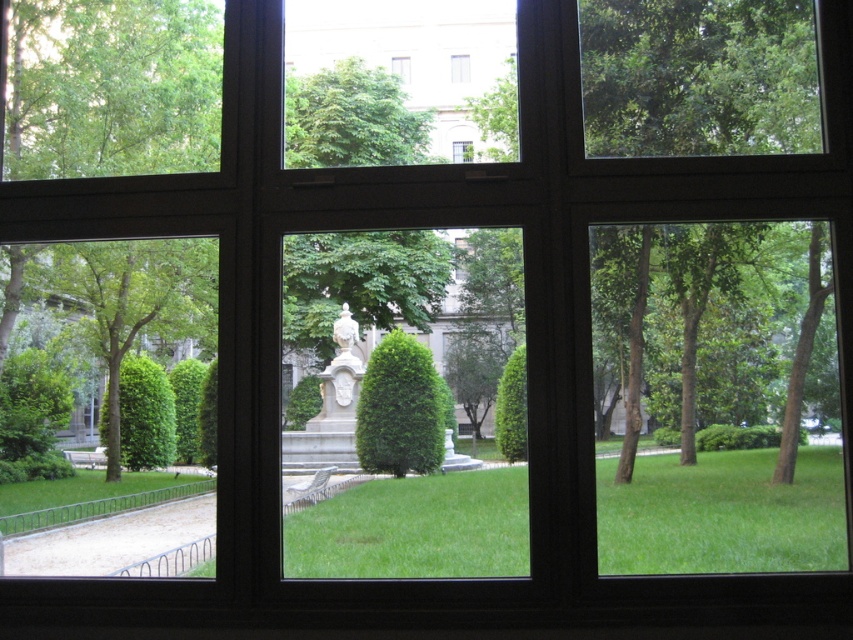
You are an artist planning to sketch the park scene through the transparent glass window at upper center. You notice the white marble statue at center. Will the statue fit entirely within the window frame when viewed from your current position?

The white marble statue at center is wider than the transparent glass window at upper center, so it will not fit entirely within the window frame from your current position.

You are standing in a room looking through the window at the park. You see the green leafy tree at lower left and the green leafy tree at center. Which tree is positioned more to the left side of the window?

The green leafy tree at lower left is positioned more to the left side of the window than the green leafy tree at center.